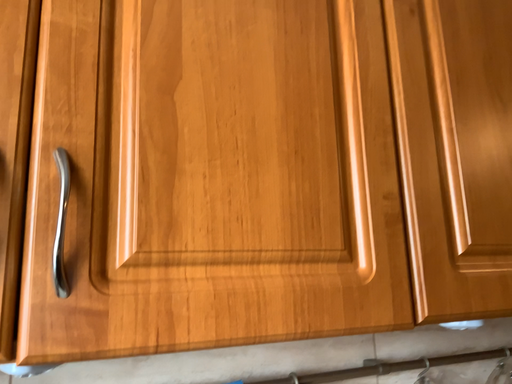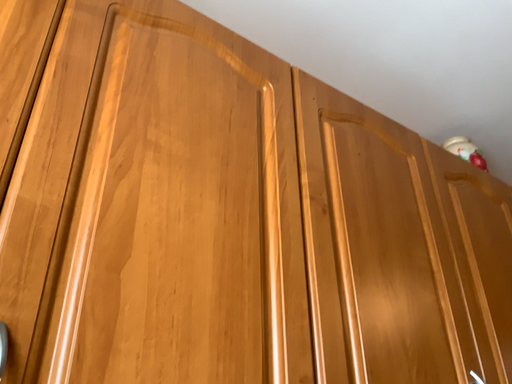
Question: How did the camera likely rotate when shooting the video?

Choices:
 (A) rotated upward
 (B) rotated downward

Answer: (A)